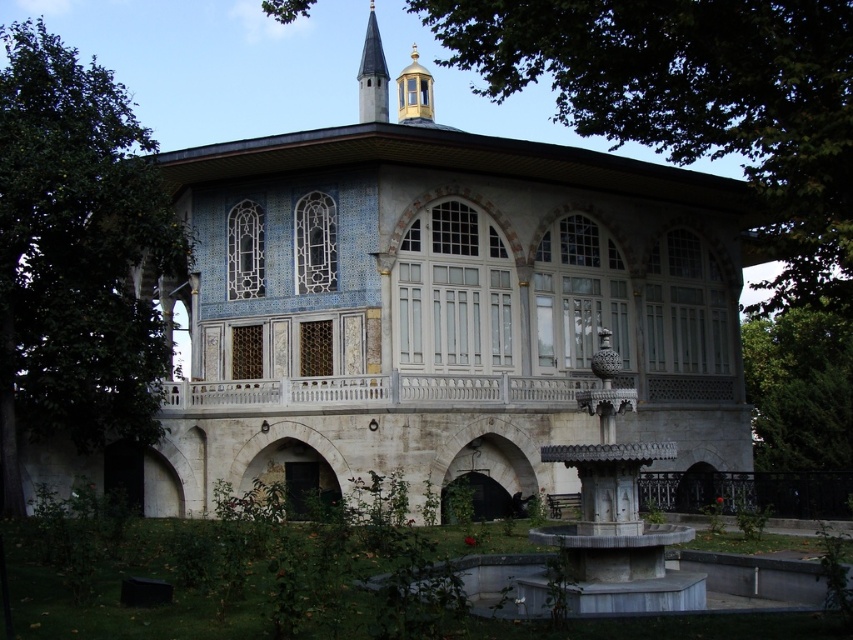
You are standing at the entrance of the building and want to take a photo of the golden dome and the slender minaret. To avoid having the green leafy tree at right blocking the view, where should you position yourself relative to the tree?

Since the green leafy tree at right is located at point (799, 410), you should position yourself to the left of the tree to ensure the golden dome and minaret are visible without obstruction.

You are a visitor standing in front of the architectural structure and want to take a photo that includes both the green leafy tree at left and the green leafy tree at right. Which tree should you position closer to the center of your camera frame to ensure both are fully visible?

The green leafy tree at left is taller than the green leafy tree at right, so you should position the taller green leafy tree at left closer to the center of your camera frame to ensure both are fully visible.

You are standing in front of the architectural structure and want to take a photo that includes both the green leafy tree at left and the green leafy tree at right. Which tree should you position closer to the center of the frame to ensure both are fully visible?

You should position the green leafy tree at left closer to the center of the frame because it is larger than the green leafy tree at right, allowing both to fit within the photo while maintaining visibility.